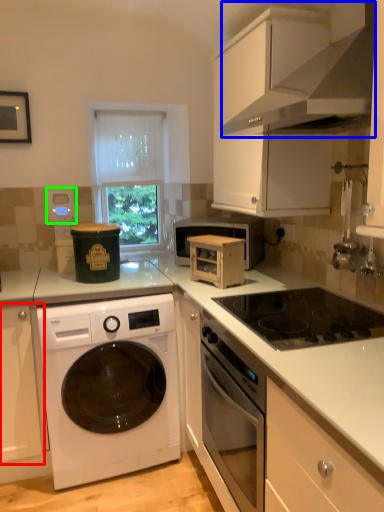
Question: Which is nearer to the cabinetry (highlighted by a red box)? exhaust hood (highlighted by a blue box) or appliance (highlighted by a green box).

Choices:
 (A) exhaust hood
 (B) appliance

Answer: (B)